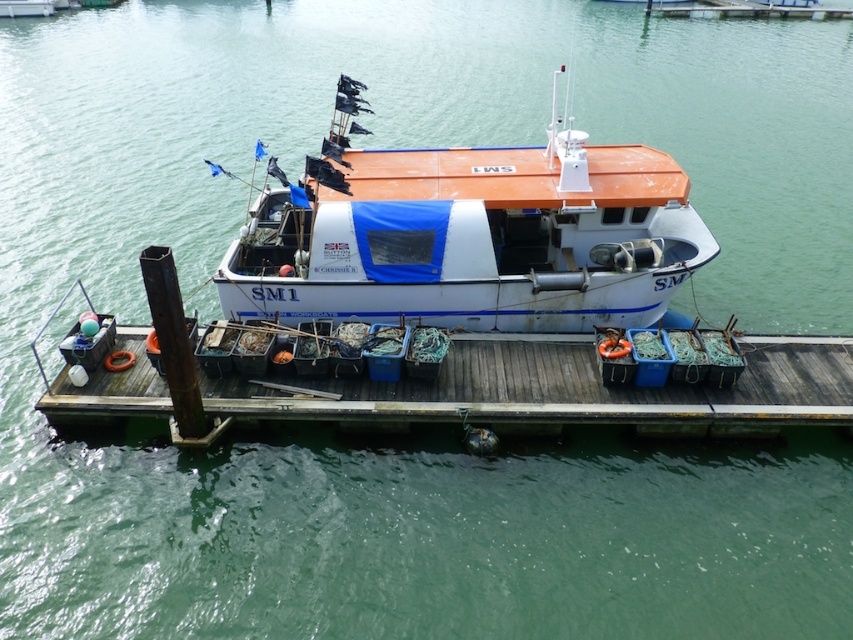
You are planning to load a large cargo container onto the white matte boat at center and the wooden dock at center. Based on their sizes, which one can accommodate the container more easily?

The white matte boat at center has a larger size compared to the wooden dock at center, so it can accommodate the container more easily.

You are standing on the wooden dock at center and want to board the white matte boat at center. Is the boat accessible from your current position?

The white matte boat at center is above wooden dock at center, so yes, you can board the boat from the wooden dock at center since it is positioned above it.

You are standing on the wooden dock at center and want to board the white matte boat at center. In which direction should you walk to reach the boat?

The white matte boat at center is to the right of the wooden dock at center, so you should walk to the right to reach the boat.